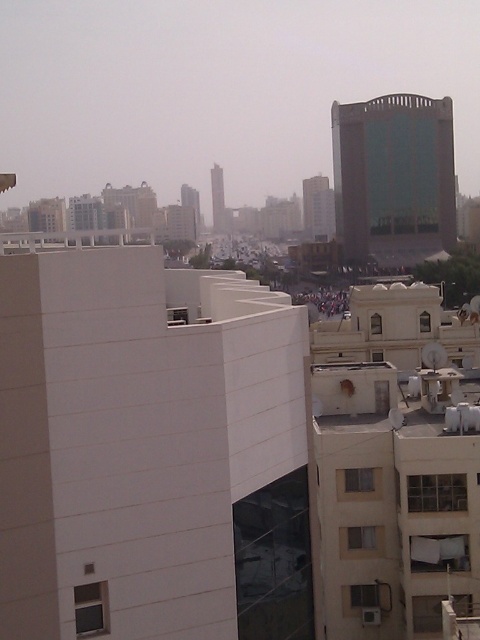
You are standing at point 0.5, 0.5 in the image. Which direction should you move to reach the white smooth building at center?

The white smooth building at center is located at point [151,449]. Since you are at point [240,320], you should move northeast to reach it.

You are standing in the urban landscape and want to take a photo of the white smooth building at center and the green glass building at upper center. Which building will appear larger in your photo?

The white smooth building at center appears larger in the photo because it is closer to you than the green glass building at upper center.